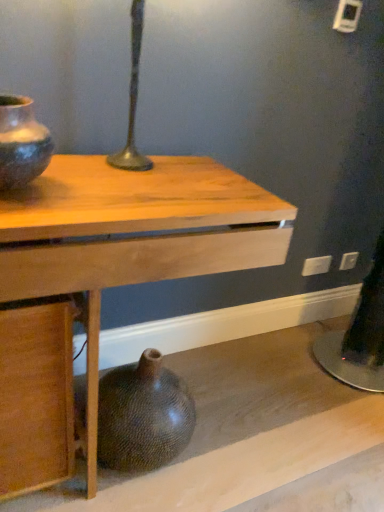
This screenshot has height=512, width=384. Find the location of `vacant space to the right of matte black vase at left, which is counted as the 2th vase, starting from the bottom`. vacant space to the right of matte black vase at left, which is counted as the 2th vase, starting from the bottom is located at coordinates (104, 196).